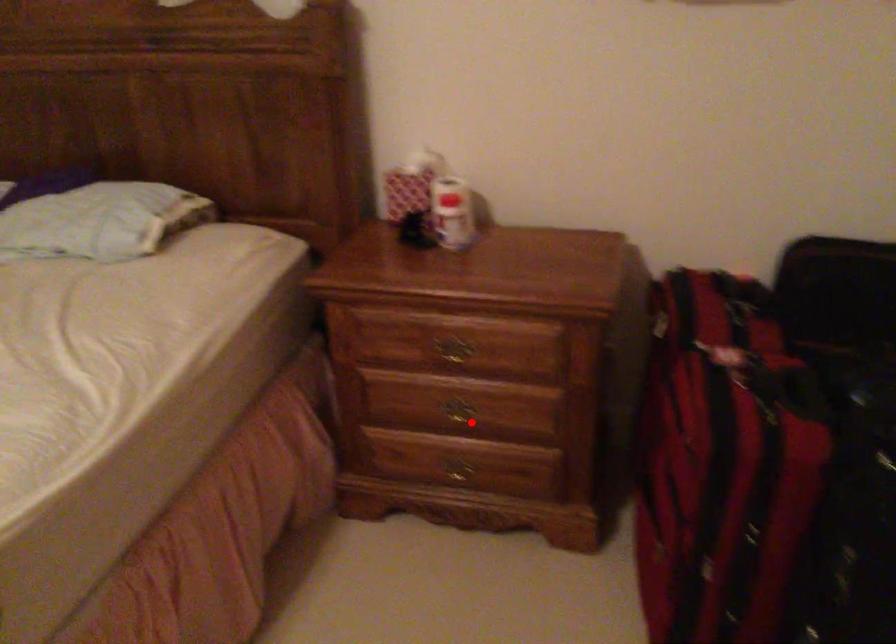
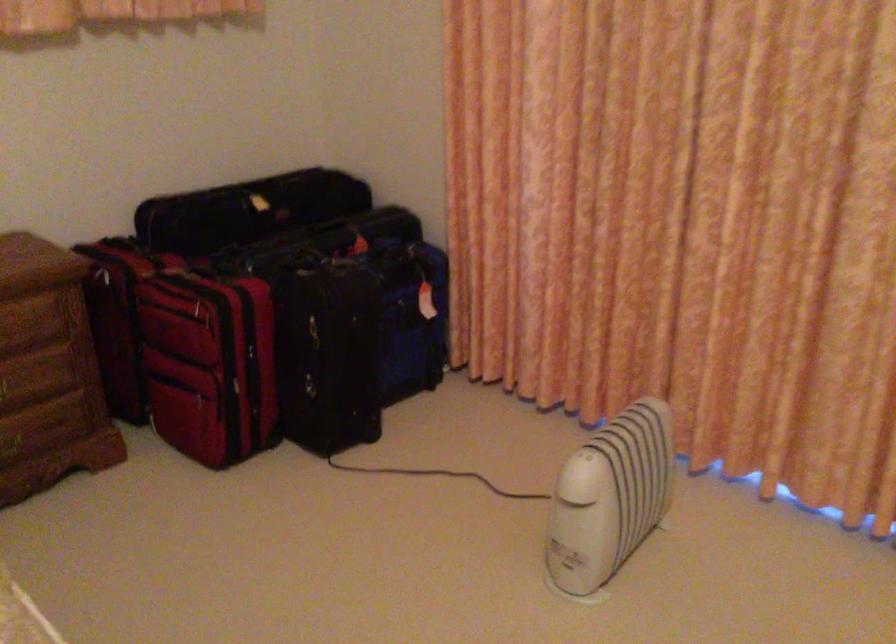
Question: I am providing you with two images of the same scene from different viewpoints. In image1, a red point is highlighted. Considering the same 3D point in image2, which of the following is correct?

Choices:
 (A) It is closer
 (B) It is farther

Answer: (B)